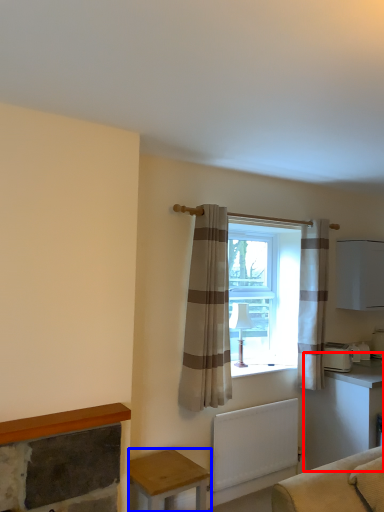
Question: Which object appears closest to the camera in this image, table (highlighted by a red box) or table (highlighted by a blue box)?

Choices:
 (A) table
 (B) table

Answer: (B)